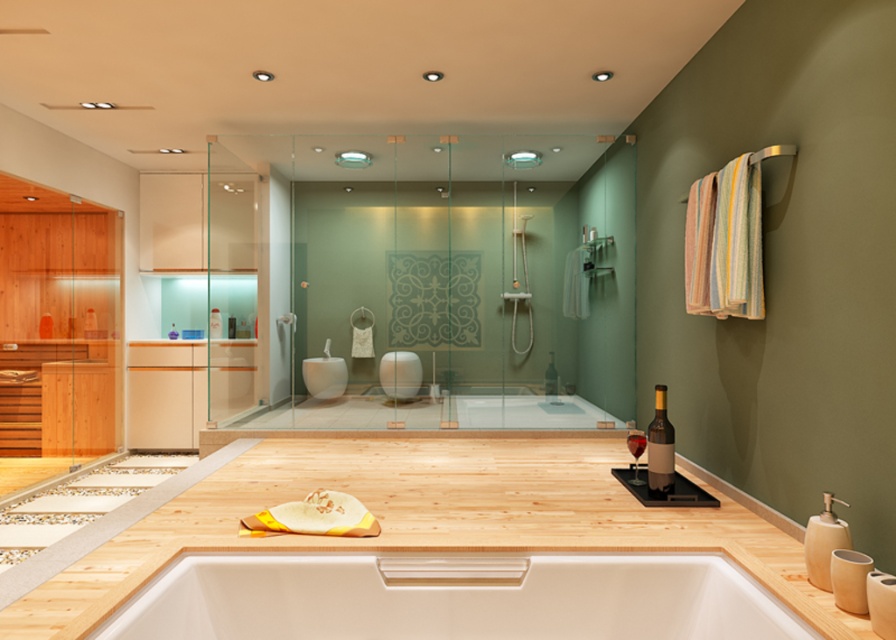
Question: Which point appears closest to the camera in this image?

Choices:
 (A) (461, 561)
 (B) (553, 360)
 (C) (660, 474)

Answer: (A)

Question: From the image, what is the correct spatial relationship of matte glass wine bottle at center in relation to dark glass wine at center?

Choices:
 (A) below
 (B) above

Answer: (B)

Question: Among these objects, which one is farthest from the camera?

Choices:
 (A) white glossy jacuzzi at lower center
 (B) transparent glass shower door at center

Answer: (B)

Question: Does transparent glass shower door at center appear on the right side of matte glass wine bottle at center?

Choices:
 (A) yes
 (B) no

Answer: (B)

Question: Considering the real-world distances, which object is farthest from the brown glass bottle at center?

Choices:
 (A) transparent glass shower door at center
 (B) dark glass wine at center
 (C) matte glass wine bottle at center

Answer: (C)

Question: In this image, where is transparent glass shower door at center located relative to dark glass wine at center?

Choices:
 (A) left
 (B) right

Answer: (A)